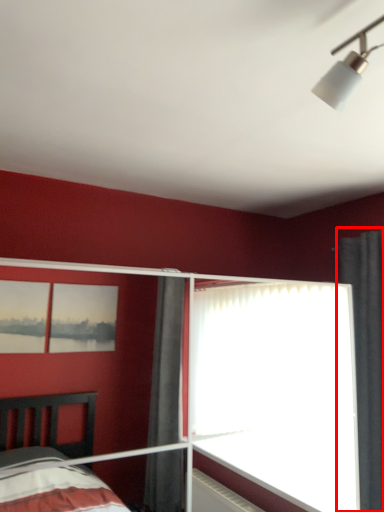
Question: From the image's perspective, considering the relative positions of curtain (annotated by the red box) and glass door in the image provided, where is curtain (annotated by the red box) located with respect to the staircase?

Choices:
 (A) above
 (B) below

Answer: (A)